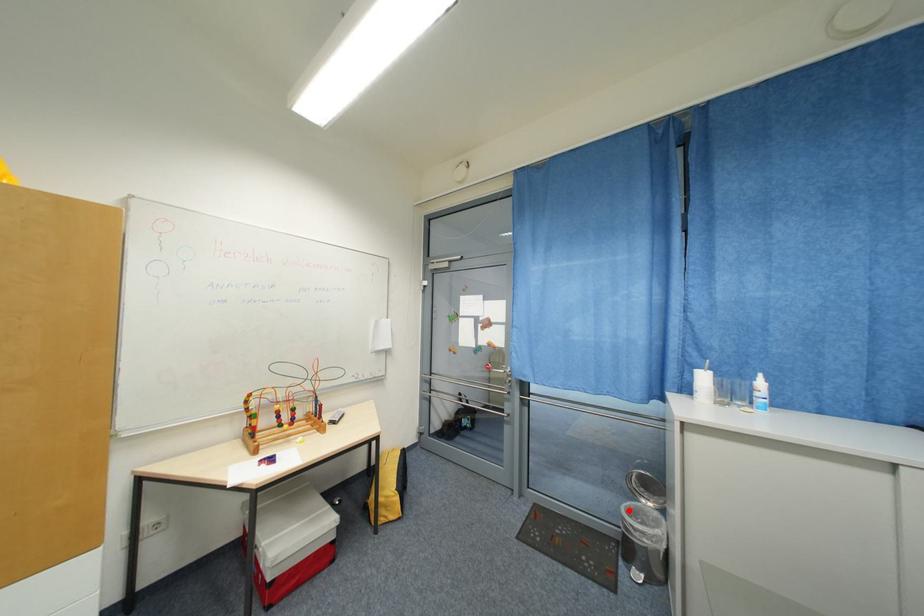
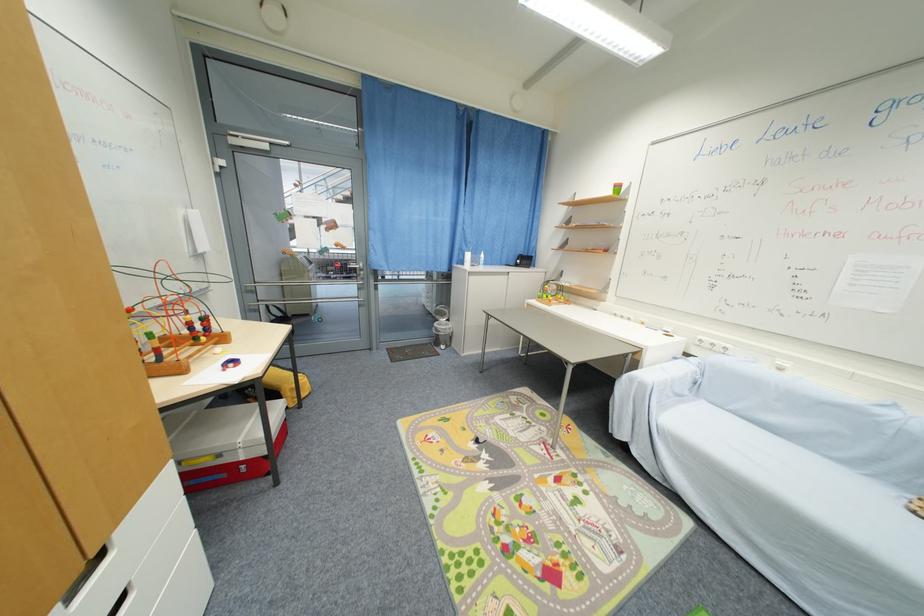
Question: A red point is marked in image1. In image2, is the corresponding 3D point closer to the camera or farther? Reply with the corresponding letter.

Choices:
 (A) The corresponding 3D point is closer.
 (B) The corresponding 3D point is farther.

Answer: (B)